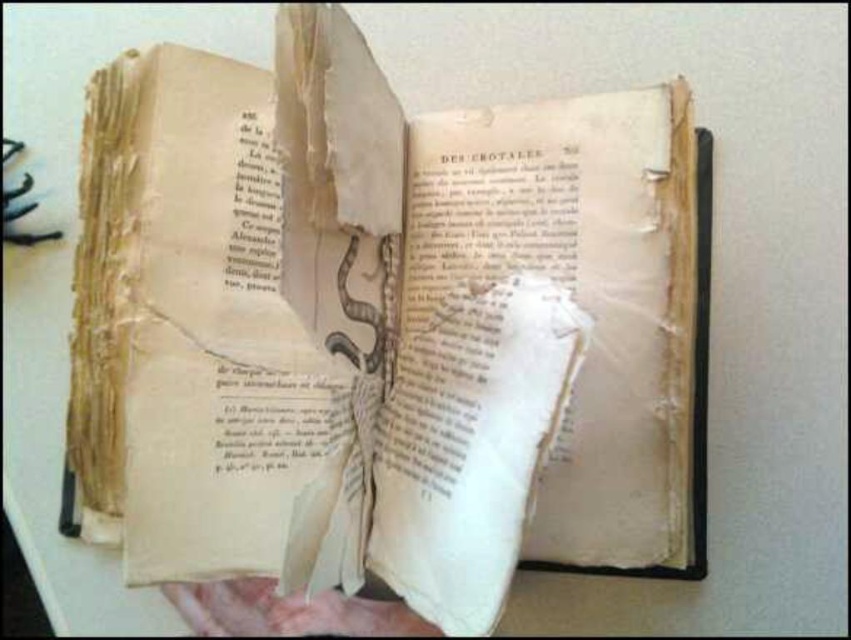
Can you confirm if yellowed paper book at center is thinner than pink flesh at lower center?

In fact, yellowed paper book at center might be wider than pink flesh at lower center.

Is point (244, 243) more distant than point (241, 600)?

Yes, point (244, 243) is behind point (241, 600).

Where is `yellowed paper book at center`? yellowed paper book at center is located at coordinates (378, 324).